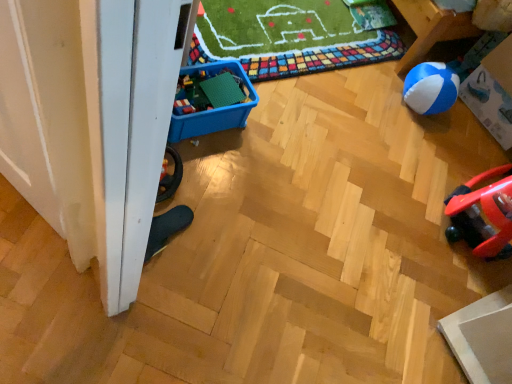
Question: Does point (218, 120) appear closer or farther from the camera than point (495, 100)?

Choices:
 (A) farther
 (B) closer

Answer: (B)

Question: From the image's perspective, is blue plastic storage box at lower left, arranged as the first storage box when viewed from the front, above or below blue and white plastic storage box at right, the 1th storage box when ordered from right to left?

Choices:
 (A) below
 (B) above

Answer: (A)

Question: Based on their relative distances, which object is nearer to the blue and white rubber ball at right?

Choices:
 (A) blue plastic storage box at lower left, the second storage box when ordered from right to left
 (B) green plastic building blocks at center-left
 (C) blue and white plastic storage box at right, positioned as the 2th storage box in left-to-right order

Answer: (C)

Question: Considering the real-world distances, which object is farthest from the blue plastic storage box at lower left, which is the second storage box from back to front?

Choices:
 (A) blue and white plastic storage box at right, the second storage box from the front
 (B) green plastic building blocks at center-left
 (C) blue and white rubber ball at right

Answer: (A)